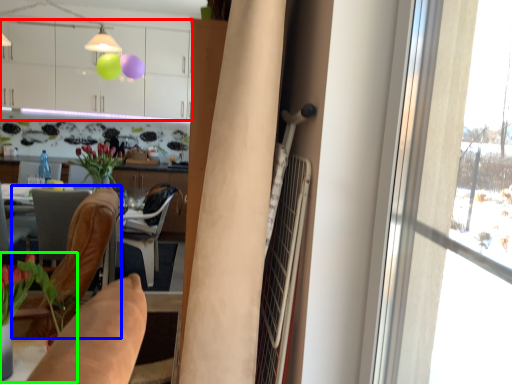
Question: Considering the real-world distances, which object is farthest from cabinetry (highlighted by a red box)? chair (highlighted by a blue box) or houseplant (highlighted by a green box)?

Choices:
 (A) chair
 (B) houseplant

Answer: (B)